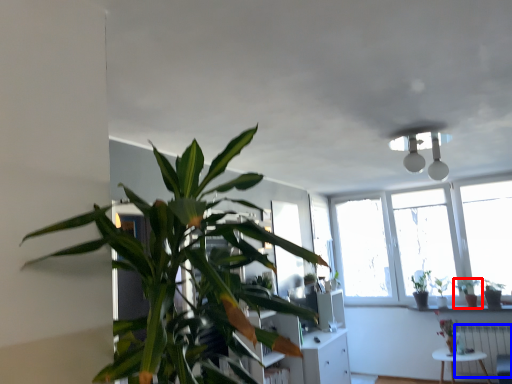
Question: Which point is further to the camera, houseplant (highlighted by a red box) or radiator (highlighted by a blue box)?

Choices:
 (A) houseplant
 (B) radiator

Answer: (A)